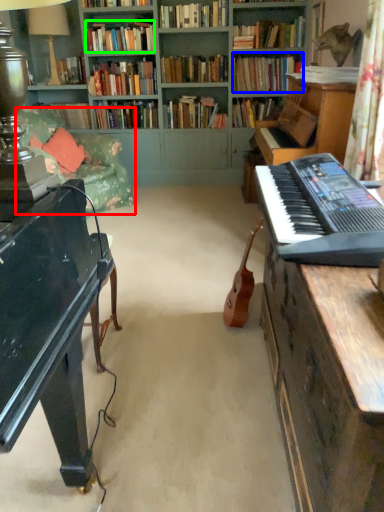
Question: Based on their relative distances, which object is farther from studio couch (highlighted by a red box)? Choose from book (highlighted by a blue box) and book (highlighted by a green box).

Choices:
 (A) book
 (B) book

Answer: (A)